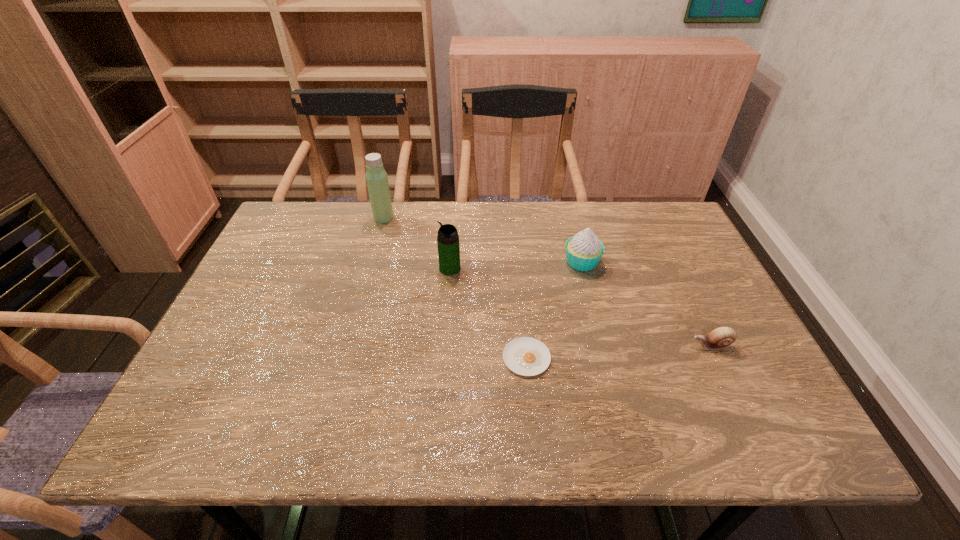
This screenshot has width=960, height=540. What are the coordinates of `object at the right edge` in the screenshot? It's located at (722, 337).

Identify the location of blank space at the far edge. (359, 230).

I want to click on free region at the near edge of the desktop, so click(x=343, y=440).

The width and height of the screenshot is (960, 540). What are the coordinates of `vacant space at the left edge of the desktop` in the screenshot? It's located at (308, 265).

I want to click on free space at the far left corner, so click(288, 238).

Where is `vacant area that lies between the tallest object and the egg yolk`? vacant area that lies between the tallest object and the egg yolk is located at coordinates (455, 288).

Identify the location of empty location between the third shortest object and the farthest object. (483, 240).

Identify the location of free space between the escargot and the third object from right to left. Image resolution: width=960 pixels, height=540 pixels. (619, 352).

Identify the location of free space between the fourth tallest object and the egg yolk. The image size is (960, 540). (619, 352).

This screenshot has width=960, height=540. Find the location of `vacant space that is in between the rightmost object and the second object from right to left`. vacant space that is in between the rightmost object and the second object from right to left is located at coordinates (646, 303).